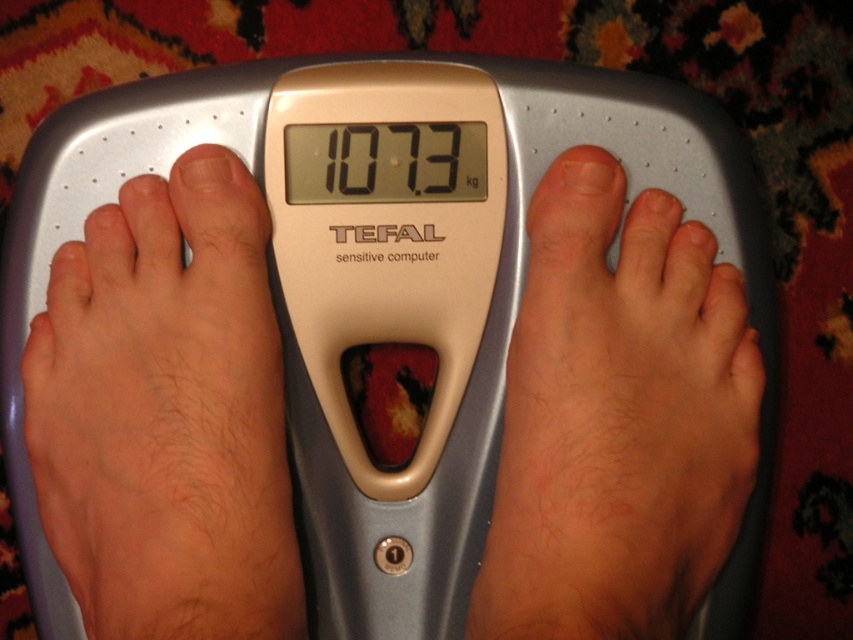
Question: Can you confirm if hair-covered skin at left is positioned above smooth skin foot at center?

Choices:
 (A) yes
 (B) no

Answer: (A)

Question: Which point appears closest to the camera in this image?

Choices:
 (A) (601, 636)
 (B) (244, 604)

Answer: (A)

Question: Is hair-covered skin at left further to the viewer compared to smooth skin foot at center?

Choices:
 (A) no
 (B) yes

Answer: (B)

Question: Which point appears farthest from the camera in this image?

Choices:
 (A) (587, 291)
 (B) (256, 371)

Answer: (A)

Question: Can you confirm if hair-covered skin at left is positioned above smooth skin foot at center?

Choices:
 (A) no
 (B) yes

Answer: (B)